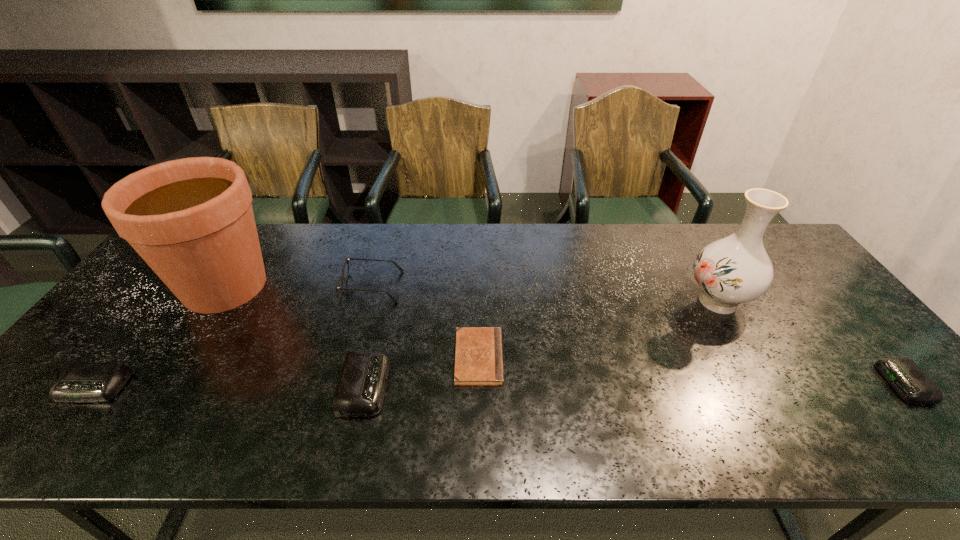
Please determine a free point for an extra alarm_clock to ensure balance. Please provide its 2D coordinates. Your answer should be formatted as a tuple, i.e. [(x, y)], where the tuple contains the x and y coordinates of a point satisfying the conditions above.

[(635, 384)]